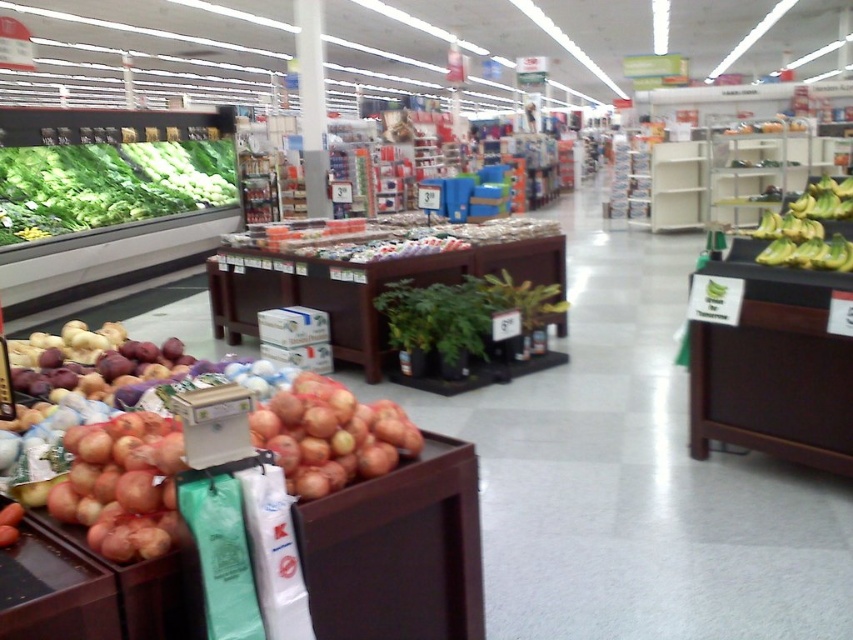
Question: Does green leafy vegetables at left lie in front of ripe red onions at lower left?

Choices:
 (A) no
 (B) yes

Answer: (A)

Question: Can you confirm if smooth red onion at lower left is smaller than green leafy vegetables at left?

Choices:
 (A) no
 (B) yes

Answer: (B)

Question: Can you confirm if smooth red onion at lower left is wider than green leafy vegetables at left?

Choices:
 (A) no
 (B) yes

Answer: (A)

Question: Which object is the farthest from the ripe red onions at lower left?

Choices:
 (A) smooth red onion at lower left
 (B) yellow smooth bananas at right
 (C) rustic brown onions at center

Answer: (B)

Question: Which object is farther from the camera taking this photo?

Choices:
 (A) yellow smooth bananas at right
 (B) ripe red onions at lower left
 (C) rustic brown onions at center

Answer: (A)

Question: Which of the following is the closest to the observer?

Choices:
 (A) ripe red onions at lower left
 (B) green leafy vegetables at left

Answer: (A)